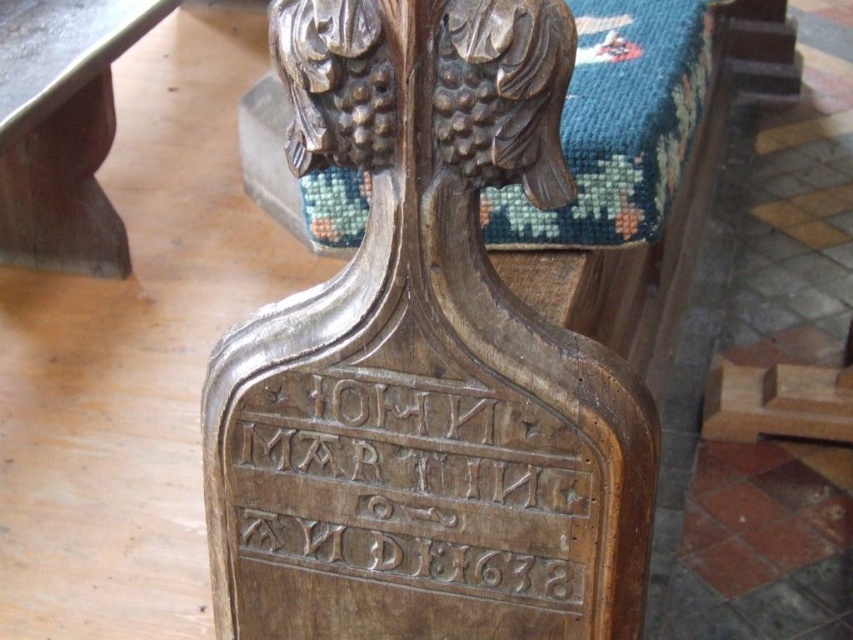
Which is in front, point (329, 104) or point (57, 230)?

Point (329, 104)

Is dark brown wood eagle at upper center to the left of wooden table at left from the viewer's perspective?

No, dark brown wood eagle at upper center is not to the left of wooden table at left.

You are a GUI agent. You are given a task and a screenshot of the screen. Output one action in this format:
    pyautogui.click(x=<x>, y=<y>)
    Task: Click on the dark brown wood eagle at upper center
    
    Given the screenshot: What is the action you would take?
    pyautogui.click(x=502, y=92)

At what (x,y) coordinates should I click in order to perform the action: click on dark brown wood eagle at upper center. Please return your answer as a coordinate pair (x, y). The height and width of the screenshot is (640, 853). Looking at the image, I should click on (502, 92).